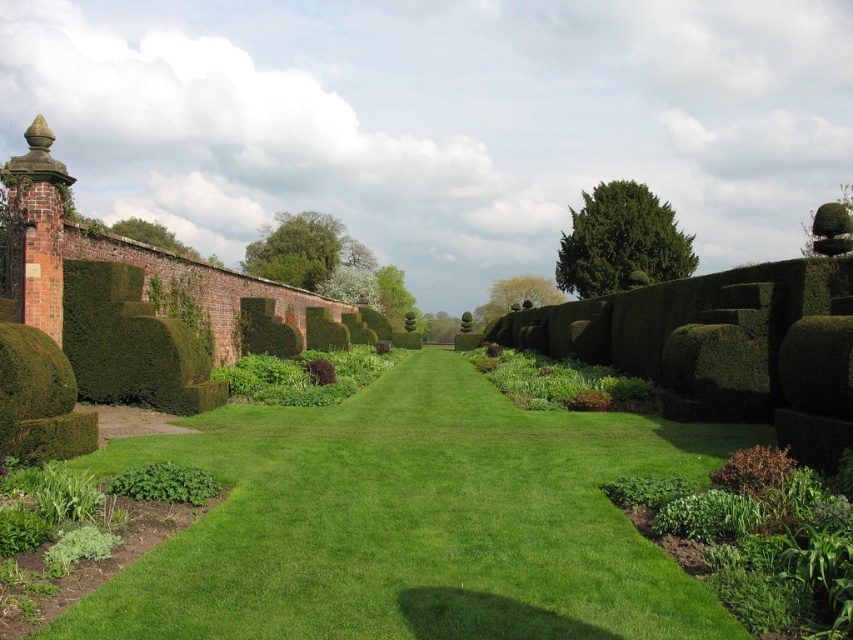
You are a gardener planning to water the green smooth lawn at center and the green leafy bush at upper center. Which object should you water first if you want to start from the closest to you?

The green smooth lawn at center is in front of the green leafy bush at upper center, so you should water the green smooth lawn at center first as it is closer to you.

You are standing at the entrance of the garden and see the green leafy bush at upper center and the green leafy bush at center. Which one is closer to you?

The green leafy bush at upper center is closer to you as it is positioned in front of the green leafy bush at center.